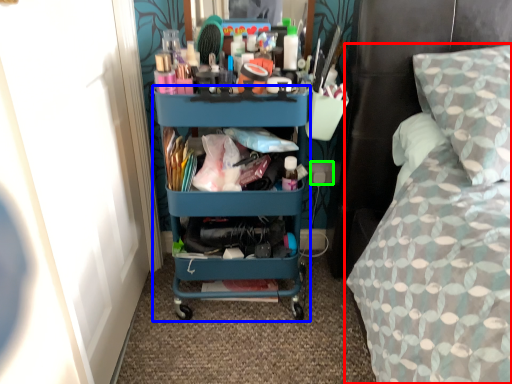
Question: Based on their relative distances, which object is farther from bed (highlighted by a red box)? Choose from desk (highlighted by a blue box) and power outlet (highlighted by a green box).

Choices:
 (A) desk
 (B) power outlet

Answer: (B)